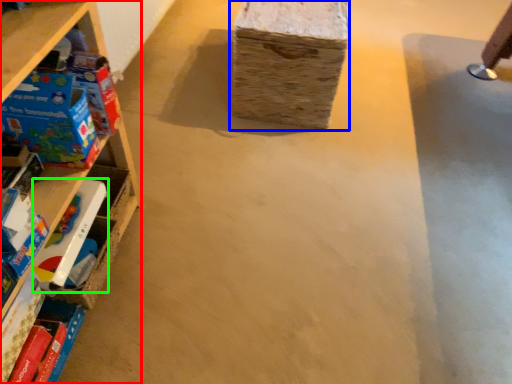
Question: Which object is the farthest from shelf (highlighted by a red box)? Choose among these: cardboard box (highlighted by a blue box) or toy (highlighted by a green box).

Choices:
 (A) cardboard box
 (B) toy

Answer: (A)